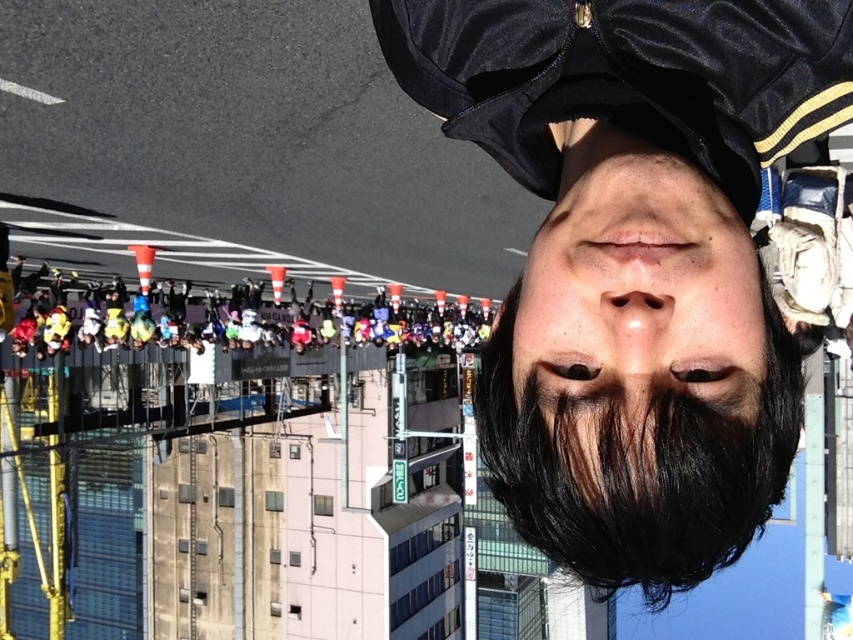
You are a photographer trying to capture a closeup of the black satin cap at upper center and the matte skin nose at center in this upside down image. How far apart are these two objects in centimeters?

The black satin cap at upper center is 45.66 centimeters from the matte skin nose at center.

You are a drone operator trying to navigate through an urban area. You have two points to consider in your camera feed, point A at coordinates point (641, 307) and point B at coordinates point (721, 248). Given the inverted camera perspective, which point is closer to your drone?

Point point (641, 307) is closer to the viewer than point point (721, 248), so point A is closer to the drone.